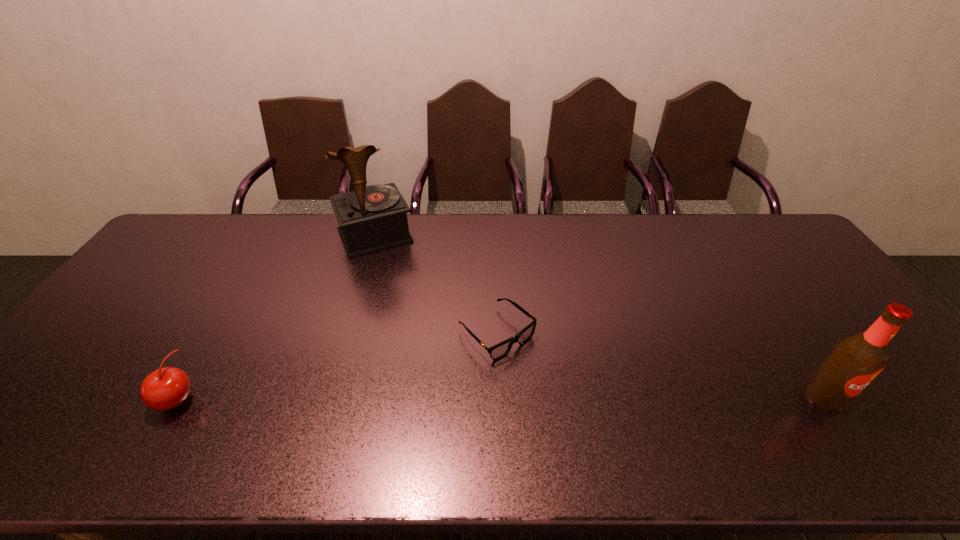
What are the coordinates of `empty space between the phonograph_record and the second shortest object` in the screenshot? It's located at (276, 317).

Where is `vacant area that lies between the rightmost object and the shortest object`? This screenshot has width=960, height=540. vacant area that lies between the rightmost object and the shortest object is located at coordinates (660, 366).

Where is `free space between the third object from left to right and the leftmost object`? The width and height of the screenshot is (960, 540). free space between the third object from left to right and the leftmost object is located at coordinates (337, 366).

The width and height of the screenshot is (960, 540). Find the location of `free space between the shortest object and the second object from left to right`. free space between the shortest object and the second object from left to right is located at coordinates (436, 285).

Select which object appears as the third closest to the second tallest object. Please provide its 2D coordinates. Your answer should be formatted as a tuple, i.e. [(x, y)], where the tuple contains the x and y coordinates of a point satisfying the conditions above.

[(166, 388)]

You are a GUI agent. You are given a task and a screenshot of the screen. Output one action in this format:
    pyautogui.click(x=<x>, y=<y>)
    Task: Click on the object that is the third closest to the farthest object
    Image resolution: width=960 pixels, height=540 pixels.
    Given the screenshot: What is the action you would take?
    pyautogui.click(x=855, y=361)

Identify the location of free space in the image that satisfies the following two spatial constraints: 1. on the back side of the leftmost object; 2. on the right side of the sunglasses. Image resolution: width=960 pixels, height=540 pixels. (215, 333).

Locate an element on the screen. This screenshot has width=960, height=540. blank space that satisfies the following two spatial constraints: 1. on the front side of the second object from left to right; 2. on the left side of the rightmost object is located at coordinates (327, 397).